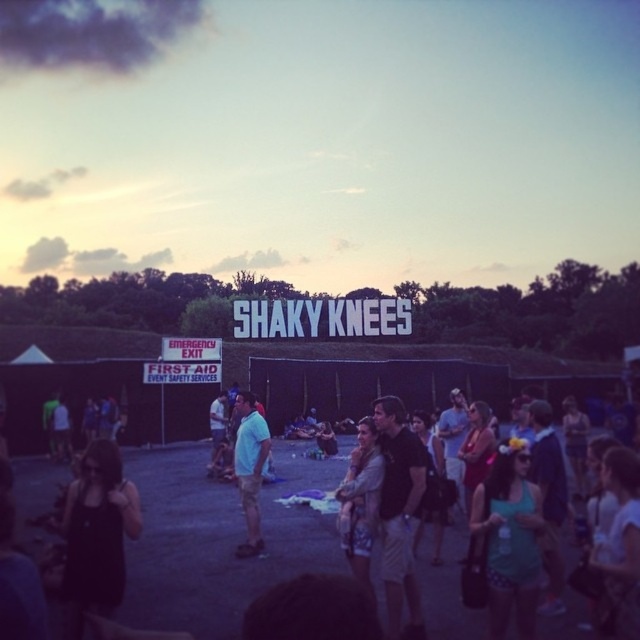
Question: Considering the relative positions of teal fabric dress at center and matte blue shirt at center in the image provided, where is teal fabric dress at center located with respect to matte blue shirt at center?

Choices:
 (A) below
 (B) above

Answer: (A)

Question: Which point appears closest to the camera in this image?

Choices:
 (A) (237, 412)
 (B) (538, 512)

Answer: (B)

Question: Can you confirm if teal fabric dress at center is positioned to the right of matte blue shirt at center?

Choices:
 (A) no
 (B) yes

Answer: (B)

Question: Which point appears closest to the camera in this image?

Choices:
 (A) (243, 472)
 (B) (522, 512)

Answer: (B)

Question: Can you confirm if teal fabric dress at center is wider than matte blue shirt at center?

Choices:
 (A) no
 (B) yes

Answer: (B)